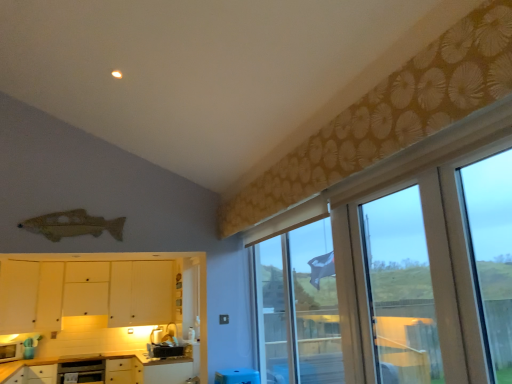
Question: Should I look upward or downward to see metallic silver oven at lower left?

Choices:
 (A) down
 (B) up

Answer: (A)

Question: From a real-world perspective, is white matte cabinet at lower left, arranged as the 2th cabinetry when viewed from the top, positioned under white matte cabinet at lower left, which ranks as the third cabinetry in bottom-to-top order, based on gravity?

Choices:
 (A) yes
 (B) no

Answer: (B)

Question: Can we say white matte cabinet at lower left, arranged as the 2th cabinetry when viewed from the top, lies outside white matte cabinet at lower left, which is counted as the first cabinetry, starting from the top?

Choices:
 (A) no
 (B) yes

Answer: (A)

Question: From the image's perspective, is white matte cabinet at lower left, the 2th cabinetry from the bottom, under white matte cabinet at lower left, which is counted as the first cabinetry, starting from the top?

Choices:
 (A) yes
 (B) no

Answer: (A)

Question: Is white matte cabinet at lower left, arranged as the 2th cabinetry when viewed from the top, next to white matte cabinet at lower left, which ranks as the third cabinetry in bottom-to-top order, and touching it?

Choices:
 (A) no
 (B) yes

Answer: (A)

Question: Does white matte cabinet at lower left, arranged as the 2th cabinetry when viewed from the top, have a lesser width compared to white matte cabinet at lower left, which is counted as the first cabinetry, starting from the top?

Choices:
 (A) no
 (B) yes

Answer: (B)

Question: Considering the relative sizes of white matte cabinet at lower left, the 2th cabinetry from the bottom, and white matte cabinet at lower left, which ranks as the third cabinetry in bottom-to-top order, in the image provided, is white matte cabinet at lower left, the 2th cabinetry from the bottom, bigger than white matte cabinet at lower left, which ranks as the third cabinetry in bottom-to-top order,?

Choices:
 (A) no
 (B) yes

Answer: (A)

Question: Is metallic silver oven at lower left wider than white glossy microwave at lower left, the first appliance viewed from the left?

Choices:
 (A) no
 (B) yes

Answer: (B)

Question: Is metallic silver oven at lower left not close to white glossy microwave at lower left, placed as the second appliance when sorted from right to left?

Choices:
 (A) no
 (B) yes

Answer: (A)

Question: Is metallic silver oven at lower left at the right side of white glossy microwave at lower left, placed as the second appliance when sorted from right to left?

Choices:
 (A) yes
 (B) no

Answer: (A)

Question: From a real-world perspective, is metallic silver oven at lower left beneath white glossy microwave at lower left, the first appliance viewed from the left?

Choices:
 (A) no
 (B) yes

Answer: (B)

Question: From the image's perspective, is metallic silver oven at lower left on top of white glossy microwave at lower left, placed as the second appliance when sorted from right to left?

Choices:
 (A) no
 (B) yes

Answer: (A)

Question: Does metallic silver oven at lower left come in front of white glossy microwave at lower left, placed as the second appliance when sorted from right to left?

Choices:
 (A) yes
 (B) no

Answer: (B)

Question: Is white matte cabinet at lower left, which appears as the first cabinetry when ordered from the bottom, not close to white matte cabinet at lower left, which ranks as the third cabinetry in bottom-to-top order?

Choices:
 (A) yes
 (B) no

Answer: (B)